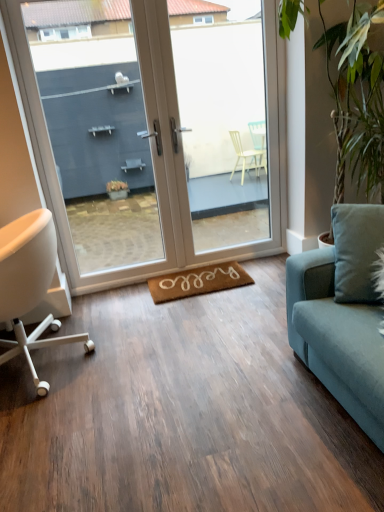
Question: Does green leafy plant at right have a larger size compared to white matte chair at left?

Choices:
 (A) yes
 (B) no

Answer: (A)

Question: Considering the relative positions of green leafy plant at right and white matte chair at left in the image provided, is green leafy plant at right to the right of white matte chair at left from the viewer's perspective?

Choices:
 (A) yes
 (B) no

Answer: (A)

Question: Does green leafy plant at right have a lesser width compared to white matte chair at left?

Choices:
 (A) no
 (B) yes

Answer: (A)

Question: From the image's perspective, is green leafy plant at right located above white matte chair at left?

Choices:
 (A) yes
 (B) no

Answer: (A)

Question: Is green leafy plant at right looking in the opposite direction of white matte chair at left?

Choices:
 (A) yes
 (B) no

Answer: (B)

Question: Is green leafy plant at right positioned far away from white matte chair at left?

Choices:
 (A) yes
 (B) no

Answer: (A)

Question: Is white glossy door at center shorter than brown coir yoga mat at center?

Choices:
 (A) yes
 (B) no

Answer: (B)

Question: Can you confirm if white glossy door at center is thinner than brown coir yoga mat at center?

Choices:
 (A) yes
 (B) no

Answer: (A)

Question: Is white glossy door at center positioned beyond the bounds of brown coir yoga mat at center?

Choices:
 (A) yes
 (B) no

Answer: (A)

Question: Is white glossy door at center closer to camera compared to brown coir yoga mat at center?

Choices:
 (A) yes
 (B) no

Answer: (A)

Question: Is white glossy door at center smaller than brown coir yoga mat at center?

Choices:
 (A) no
 (B) yes

Answer: (A)

Question: Can you confirm if white glossy door at center is taller than brown coir yoga mat at center?

Choices:
 (A) no
 (B) yes

Answer: (B)

Question: Is transparent glass door at center taller than white matte chair at left?

Choices:
 (A) no
 (B) yes

Answer: (B)